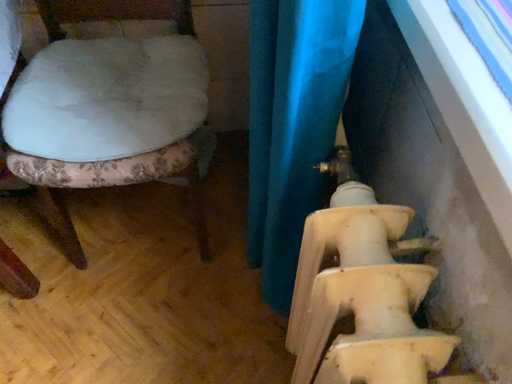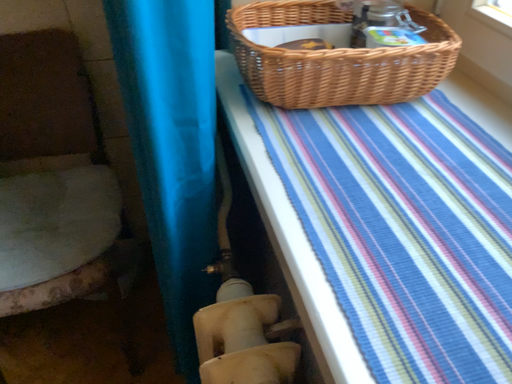
Question: Which way did the camera rotate in the video?

Choices:
 (A) rotated right
 (B) rotated left

Answer: (A)